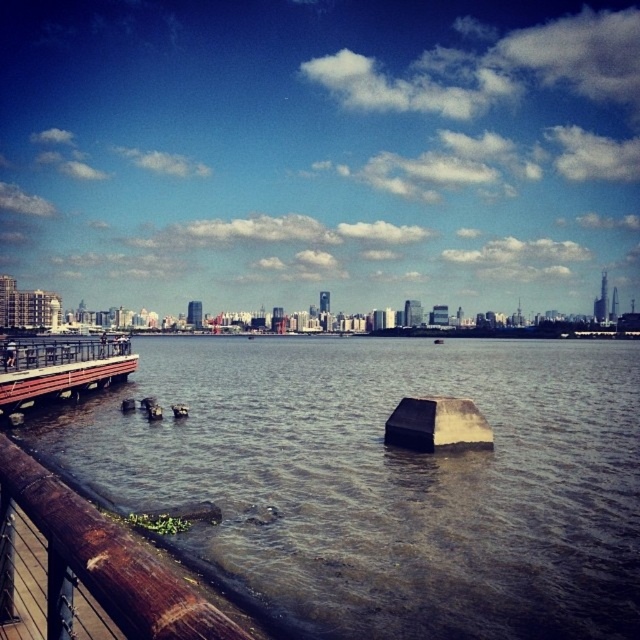
Question: Is brown wooden dock at lower left closer to the viewer compared to wooden dock at lower left?

Choices:
 (A) yes
 (B) no

Answer: (A)

Question: Which point is farther to the camera?

Choices:
 (A) (477, 433)
 (B) (109, 381)
 (C) (454, 538)
 (D) (188, 586)

Answer: (B)

Question: Which object is the closest to the black matte stone at center?

Choices:
 (A) brown wooden rail at lower left
 (B) brown wooden dock at lower left
 (C) wooden dock at lower left

Answer: (A)

Question: Is brown wooden rail at lower left smaller than wooden dock at lower left?

Choices:
 (A) yes
 (B) no

Answer: (A)

Question: Can you confirm if brown wooden dock at lower left is smaller than wooden dock at lower left?

Choices:
 (A) no
 (B) yes

Answer: (A)

Question: Which of the following is the closest to the observer?

Choices:
 (A) (17, 401)
 (B) (346, 573)

Answer: (B)